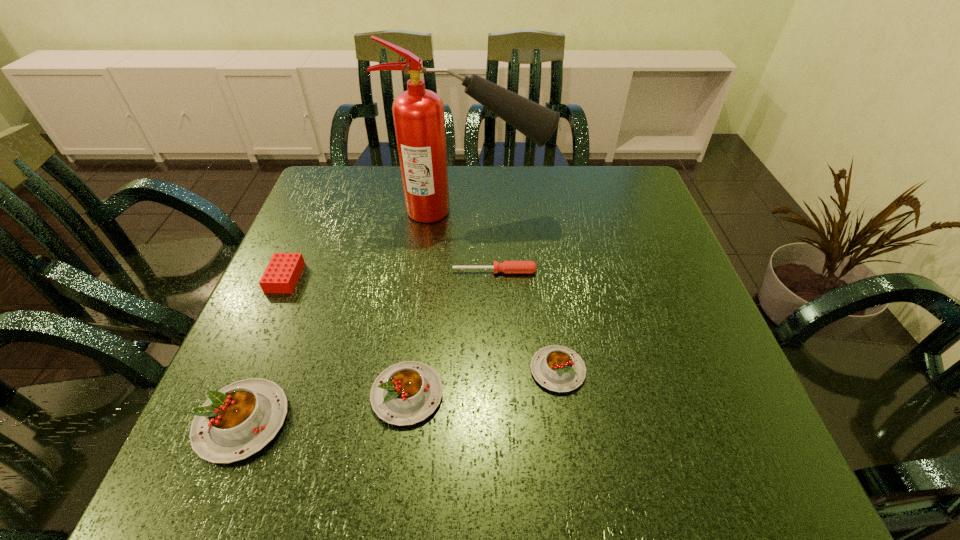
This screenshot has width=960, height=540. Find the location of `vacant place for an extra pudding on the right`. vacant place for an extra pudding on the right is located at coordinates (696, 348).